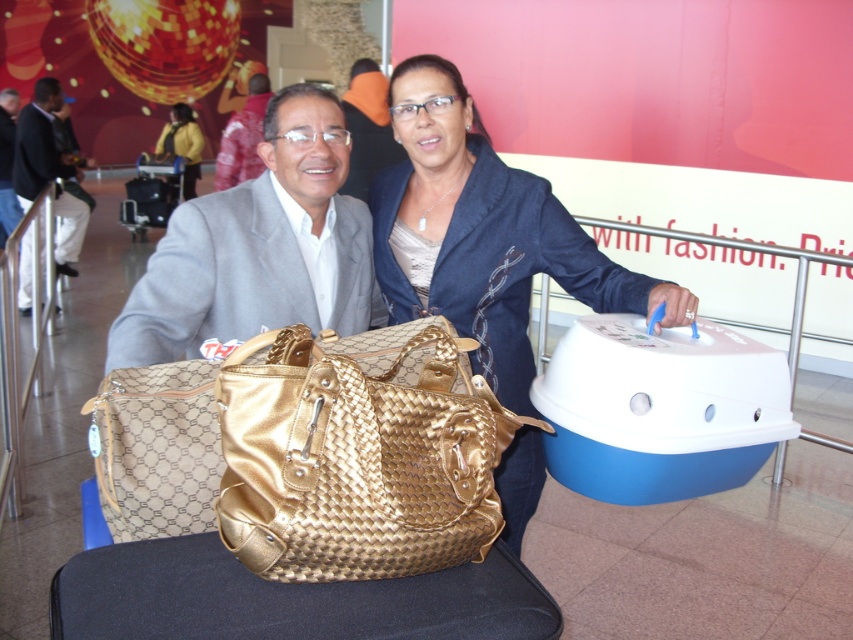
In the scene shown: You are packing for a trip and need to choose between the gold metallic handbag at center and the brushed metal suitcase at lower left. Which one can fit more items inside?

The brushed metal suitcase at lower left has a greater width than the gold metallic handbag at center, so it can fit more items inside.